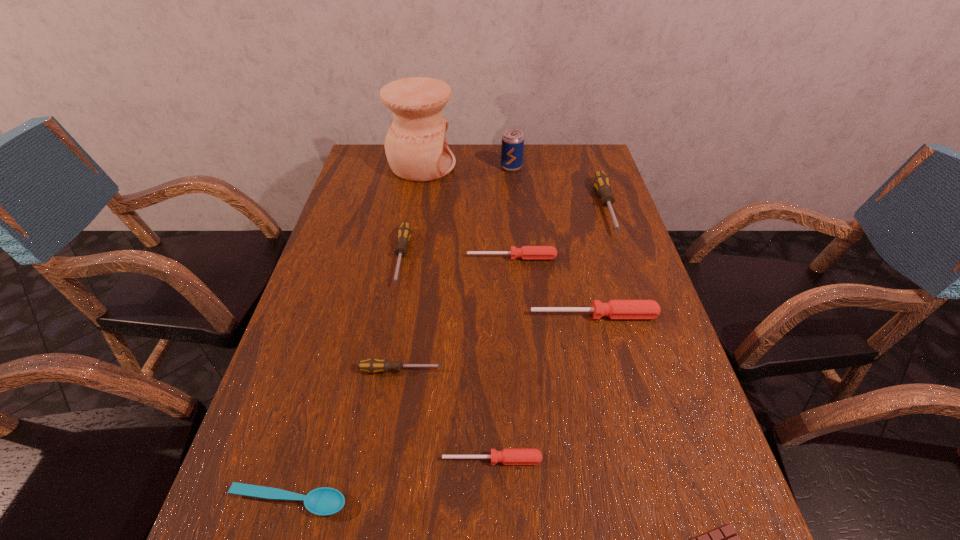
Locate an element on the screen. free space between the shortest screwdriver and the pottery is located at coordinates (457, 313).

At what (x,y) coordinates should I click in order to perform the action: click on free space between the second farthest red screwdriver and the rightmost gray screwdriver. Please return your answer as a coordinate pair (x, y). Looking at the image, I should click on (600, 261).

The height and width of the screenshot is (540, 960). Identify the location of free area in between the shortest screwdriver and the ninth shortest object. (502, 313).

What are the coordinates of `free spot between the tallest screwdriver and the second smallest red screwdriver` in the screenshot? It's located at (559, 233).

Locate an element on the screen. Image resolution: width=960 pixels, height=540 pixels. object that can be found as the eighth closest to the blue spoon is located at coordinates (416, 148).

Select which object is the fourth closest to the shortest screwdriver. Please provide its 2D coordinates. Your answer should be formatted as a tuple, i.e. [(x, y)], where the tuple contains the x and y coordinates of a point satisfying the conditions above.

[(614, 309)]

Point out which screwdriver is positioned as the nearest to the rightmost gray screwdriver. Please provide its 2D coordinates. Your answer should be formatted as a tuple, i.e. [(x, y)], where the tuple contains the x and y coordinates of a point satisfying the conditions above.

[(525, 252)]

Identify which screwdriver is the fourth nearest to the fifth nearest object. Please provide its 2D coordinates. Your answer should be formatted as a tuple, i.e. [(x, y)], where the tuple contains the x and y coordinates of a point satisfying the conditions above.

[(508, 456)]

At what (x,y) coordinates should I click in order to perform the action: click on gray screwdriver that can be found as the closest to the fourth farthest screwdriver. Please return your answer as a coordinate pair (x, y). The image size is (960, 540). Looking at the image, I should click on (373, 365).

You are a GUI agent. You are given a task and a screenshot of the screen. Output one action in this format:
    pyautogui.click(x=<x>, y=<y>)
    Task: Click on the second closest gray screwdriver relative to the sixth farthest object
    This screenshot has width=960, height=540.
    Given the screenshot: What is the action you would take?
    (x=601, y=182)